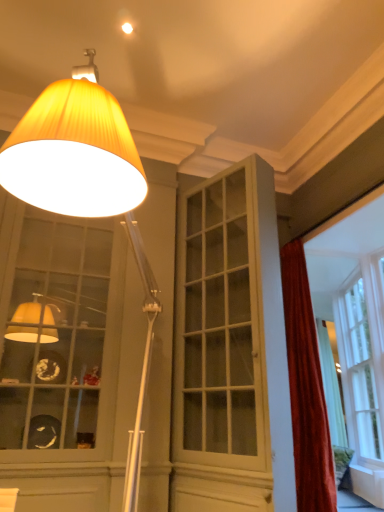
Question: From the image's perspective, is white glossy cabinet at center located beneath matte yellow fabric lampshade at upper left?

Choices:
 (A) no
 (B) yes

Answer: (B)

Question: Does white glossy cabinet at center lie in front of matte yellow fabric lampshade at upper left?

Choices:
 (A) yes
 (B) no

Answer: (B)

Question: From a real-world perspective, is white glossy cabinet at center over matte yellow fabric lampshade at upper left?

Choices:
 (A) yes
 (B) no

Answer: (A)

Question: Is matte yellow fabric lampshade at upper left completely or partially inside white glossy cabinet at center?

Choices:
 (A) yes
 (B) no

Answer: (B)

Question: Is white glossy cabinet at center thinner than matte yellow fabric lampshade at upper left?

Choices:
 (A) yes
 (B) no

Answer: (A)

Question: Is matte glass cabinet at left, which appears as the 2th window when viewed from the right, spatially inside white glossy cabinet at center, or outside of it?

Choices:
 (A) inside
 (B) outside

Answer: (B)

Question: Considering the positions of matte glass cabinet at left, marked as the first window in a left-to-right arrangement, and white glossy cabinet at center in the image, is matte glass cabinet at left, marked as the first window in a left-to-right arrangement, bigger or smaller than white glossy cabinet at center?

Choices:
 (A) small
 (B) big

Answer: (B)

Question: From a real-world perspective, is matte glass cabinet at left, marked as the first window in a left-to-right arrangement, above or below white glossy cabinet at center?

Choices:
 (A) above
 (B) below

Answer: (B)

Question: From their relative heights in the image, would you say matte glass cabinet at left, marked as the first window in a left-to-right arrangement, is taller or shorter than white glossy cabinet at center?

Choices:
 (A) short
 (B) tall

Answer: (A)

Question: Based on their positions, is matte yellow fabric lampshade at upper left located to the left or right of white glass window at right, which is the 1th window from right to left?

Choices:
 (A) right
 (B) left

Answer: (B)

Question: Is matte yellow fabric lampshade at upper left bigger or smaller than white glass window at right, which is the 1th window from right to left?

Choices:
 (A) small
 (B) big

Answer: (B)

Question: From the image's perspective, relative to white glass window at right, which is the 1th window from right to left, is matte yellow fabric lampshade at upper left above or below?

Choices:
 (A) above
 (B) below

Answer: (A)

Question: Is matte yellow fabric lampshade at upper left taller or shorter than white glass window at right, which is the 2th window from left to right?

Choices:
 (A) tall
 (B) short

Answer: (B)

Question: Is white glass window at right, which is the 2th window from left to right, spatially inside white glossy cabinet at center, or outside of it?

Choices:
 (A) outside
 (B) inside

Answer: (A)

Question: From a real-world perspective, relative to white glossy cabinet at center, is white glass window at right, which is the 2th window from left to right, vertically above or below?

Choices:
 (A) above
 (B) below

Answer: (B)